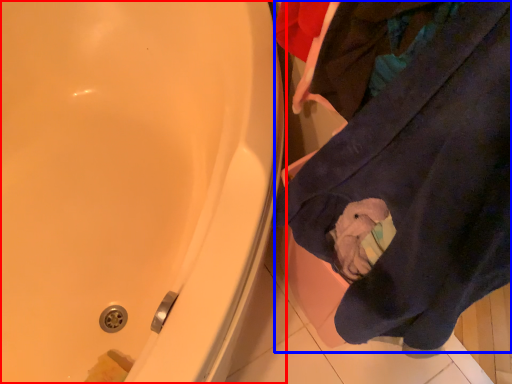
Question: Which object appears farthest to the camera in this image, bathtub (highlighted by a red box) or clothing (highlighted by a blue box)?

Choices:
 (A) bathtub
 (B) clothing

Answer: (A)